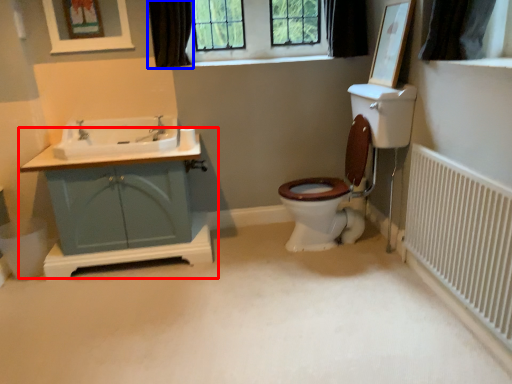
Question: Which object appears closest to the camera in this image, bathroom cabinet (highlighted by a red box) or curtain (highlighted by a blue box)?

Choices:
 (A) bathroom cabinet
 (B) curtain

Answer: (A)